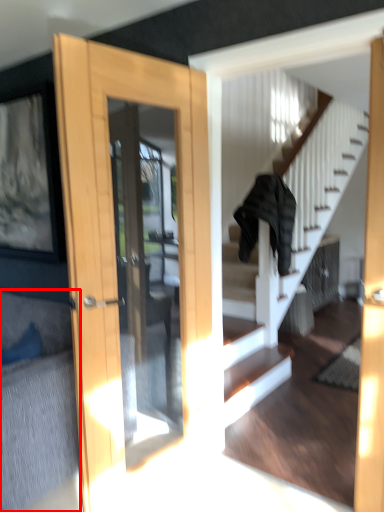
Question: Observing the image, what is the correct spatial positioning of couch (annotated by the red box) in reference to clothing?

Choices:
 (A) right
 (B) left

Answer: (B)